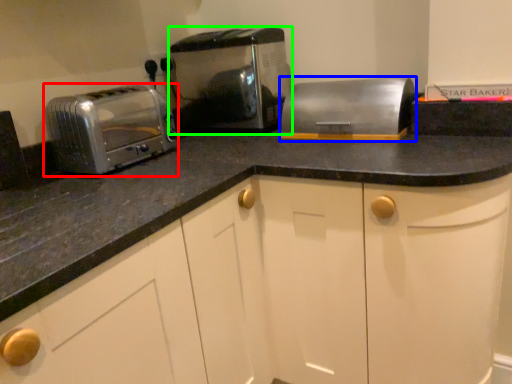
Question: Which object is positioned farthest from toaster (highlighted by a red box)? Select from appliance (highlighted by a blue box) and toaster (highlighted by a green box).

Choices:
 (A) appliance
 (B) toaster

Answer: (A)